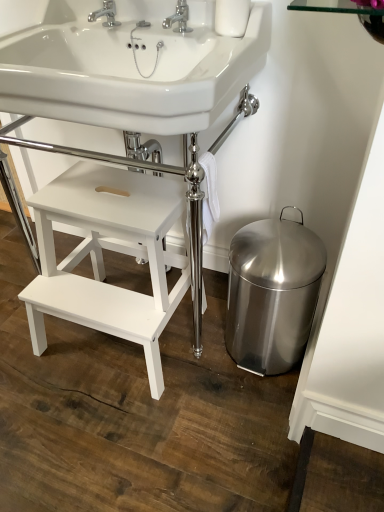
Find the location of `free spot in front of white glossy sink at upper center, positioned as the 1th sink in bottom-to-top order`. free spot in front of white glossy sink at upper center, positioned as the 1th sink in bottom-to-top order is located at coordinates (137, 430).